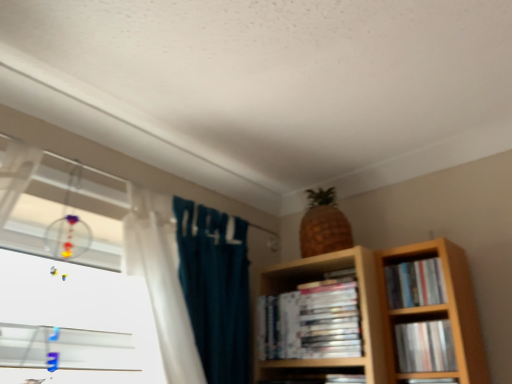
Question: Would you say matte plastic book at lower right, arranged as the 3th book when viewed from the left, is to the left or to the right of matte plastic books at center, the first book viewed from the left, in the picture?

Choices:
 (A) right
 (B) left

Answer: (A)

Question: Does point (422, 349) appear closer or farther from the camera than point (302, 324)?

Choices:
 (A) farther
 (B) closer

Answer: (B)

Question: Which is nearer to the matte plastic book at lower right, arranged as the 3th book when viewed from the left?

Choices:
 (A) matte black book at lower right, the 2th book from the left
 (B) matte plastic books at center, which is the 4th book from right to left
 (C) matte plastic books at right, the first book in the right-to-left sequence

Answer: (A)

Question: Which of these objects is positioned farthest from the matte plastic book at lower right, which is the second book in right-to-left order?

Choices:
 (A) matte plastic books at center, which is the 4th book from right to left
 (B) matte black book at lower right, which appears as the third book when viewed from the right
 (C) matte plastic books at right, the first book in the right-to-left sequence

Answer: (A)